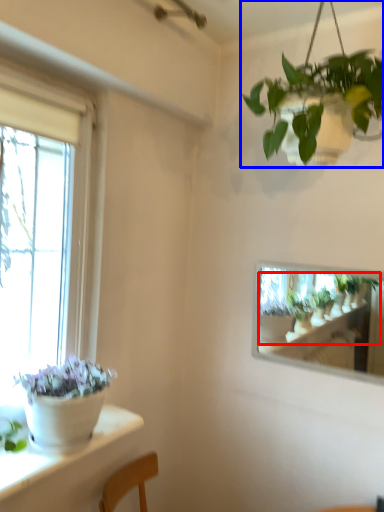
Question: Among these objects, which one is farthest to the camera, houseplant (highlighted by a red box) or houseplant (highlighted by a blue box)?

Choices:
 (A) houseplant
 (B) houseplant

Answer: (A)